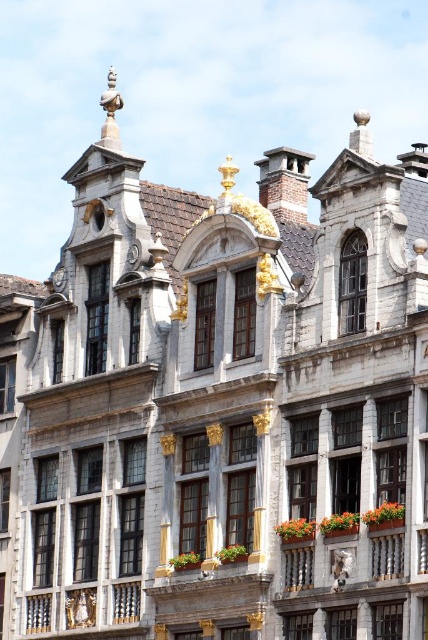
Question: Observing the image, what is the correct spatial positioning of orange fabric flower box at center in reference to wooden planter at lower right?

Choices:
 (A) below
 (B) above

Answer: (A)

Question: Does orange fabric flower box at center have a smaller size compared to wooden planter at lower right?

Choices:
 (A) yes
 (B) no

Answer: (B)

Question: Among these points, which one is nearest to the camera?

Choices:
 (A) (321, 531)
 (B) (380, 525)

Answer: (B)

Question: Which object appears closest to the camera in this image?

Choices:
 (A) orange fabric flower box at center
 (B) wooden planter at lower right

Answer: (B)

Question: Is orange fabric flower box at center bigger than wooden planter at lower right?

Choices:
 (A) no
 (B) yes

Answer: (B)

Question: Which point is closer to the camera?

Choices:
 (A) (326, 531)
 (B) (382, 524)

Answer: (B)